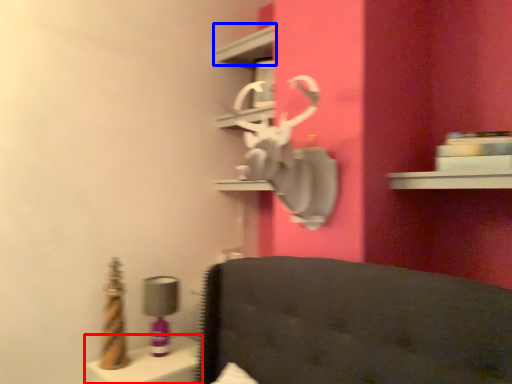
Question: Which object appears closest to the camera in this image, vanity (highlighted by a red box) or shelf (highlighted by a blue box)?

Choices:
 (A) vanity
 (B) shelf

Answer: (A)